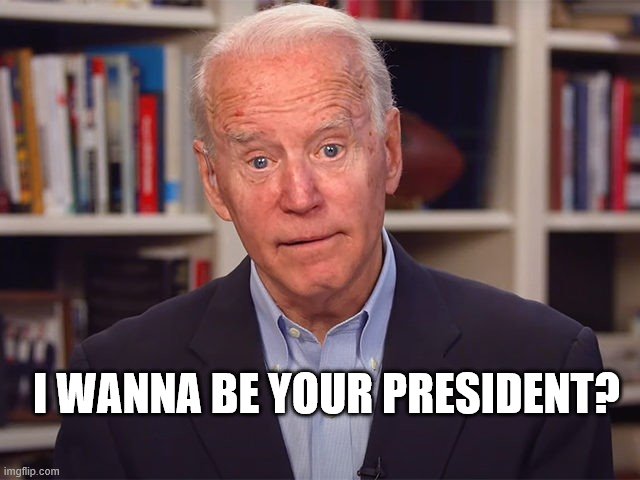
Locate an element on the screen. The height and width of the screenshot is (480, 640). book shelves is located at coordinates tap(113, 15), tap(104, 221), tap(24, 435), tap(470, 224), tap(481, 33), tap(564, 42), tap(596, 220), tap(630, 396).